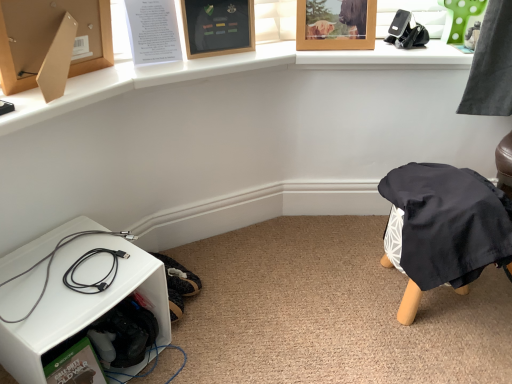
The height and width of the screenshot is (384, 512). I want to click on free spot to the right of wooden picture frame at upper center, the first picture frame positioned from the left, so click(268, 49).